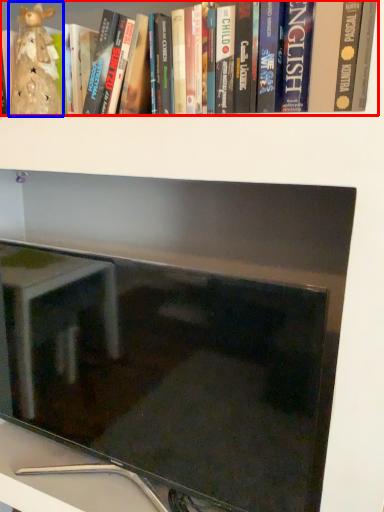
Question: Which of the following is the closest to the observer, book (highlighted by a red box) or figurine (highlighted by a blue box)?

Choices:
 (A) book
 (B) figurine

Answer: (A)